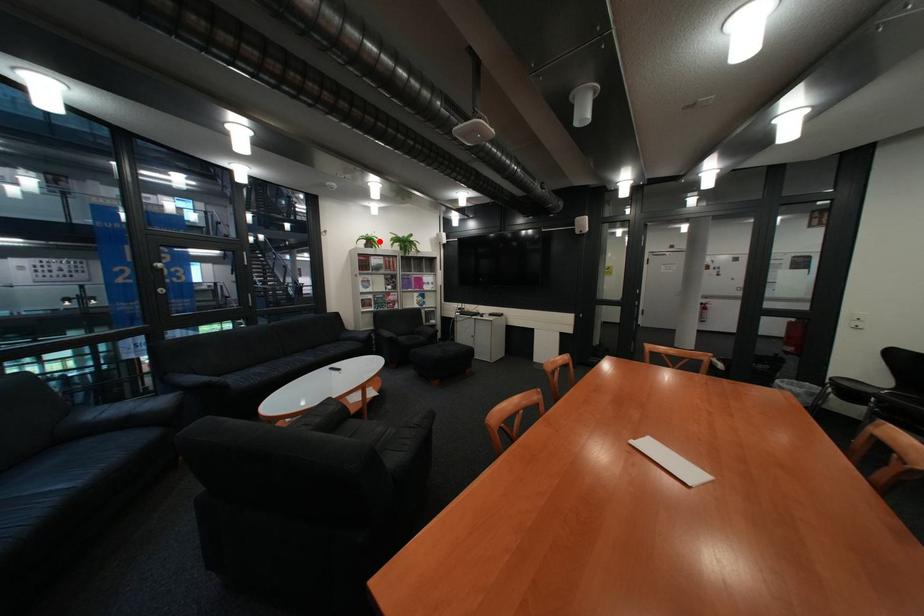
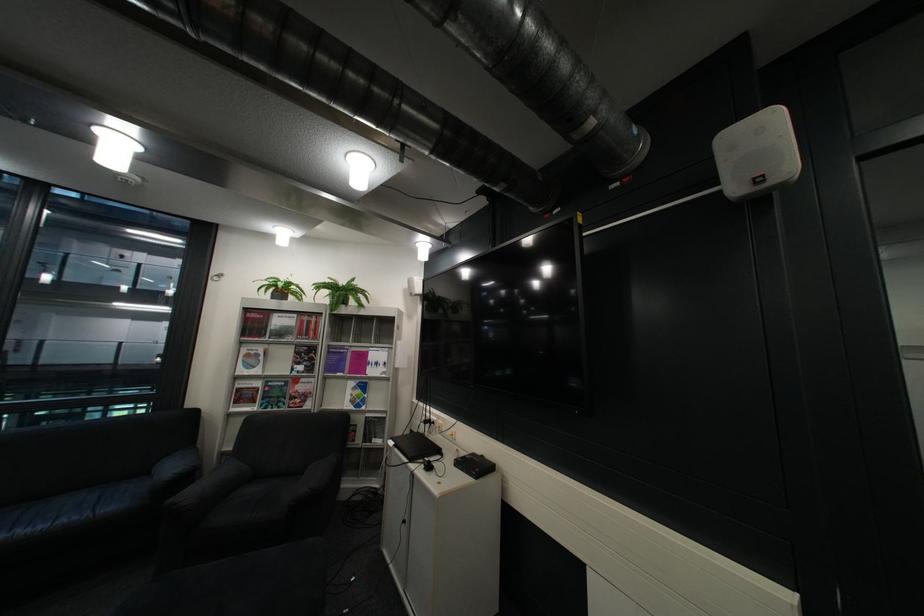
Question: A red point is marked in image1. In image2, is the corresponding 3D point closer to the camera or farther? Reply with the corresponding letter.

Choices:
 (A) The corresponding 3D point is closer.
 (B) The corresponding 3D point is farther.

Answer: (B)